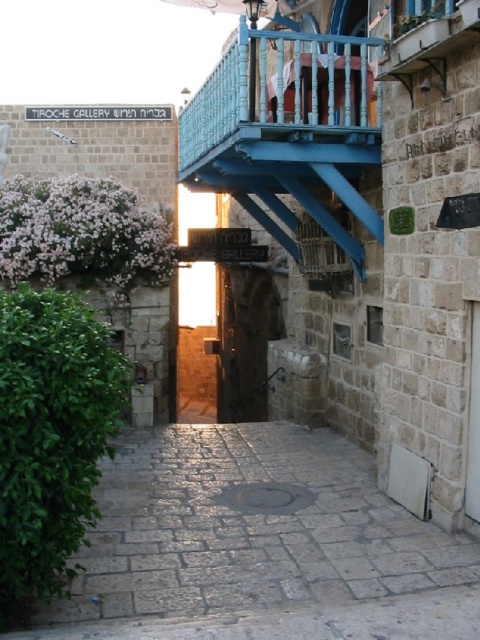
Is point (110, 496) less distant than point (351, 38)?

No, it is not.

Can you confirm if stone paved alley at center is smaller than blue painted wood balcony at upper center?

Yes.

Who is more distant from viewer, (369, 554) or (315, 145)?

The point (315, 145) is behind.

Locate an element on the screen. The width and height of the screenshot is (480, 640). stone paved alley at center is located at coordinates (260, 545).

Is blue painted wood balcony at upper center to the right of dark stone archway at center from the viewer's perspective?

Correct, you'll find blue painted wood balcony at upper center to the right of dark stone archway at center.

Can you confirm if blue painted wood balcony at upper center is positioned above dark stone archway at center?

Yes.

Image resolution: width=480 pixels, height=640 pixels. Find the location of `blue painted wood balcony at upper center`. blue painted wood balcony at upper center is located at coordinates (287, 129).

Is stone paved alley at center bigger than dark stone archway at center?

No.

Who is more forward, [305,616] or [218,358]?

Positioned in front is point [305,616].

Between point (271, 528) and point (257, 419), which one is positioned behind?

The point (257, 419) is more distant.

The image size is (480, 640). Identify the location of stone paved alley at center. (260, 545).